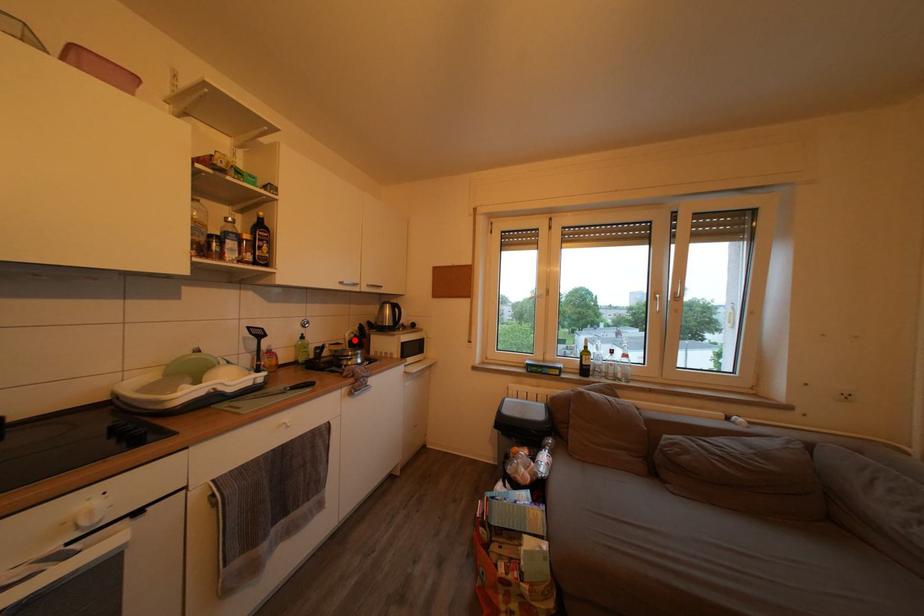
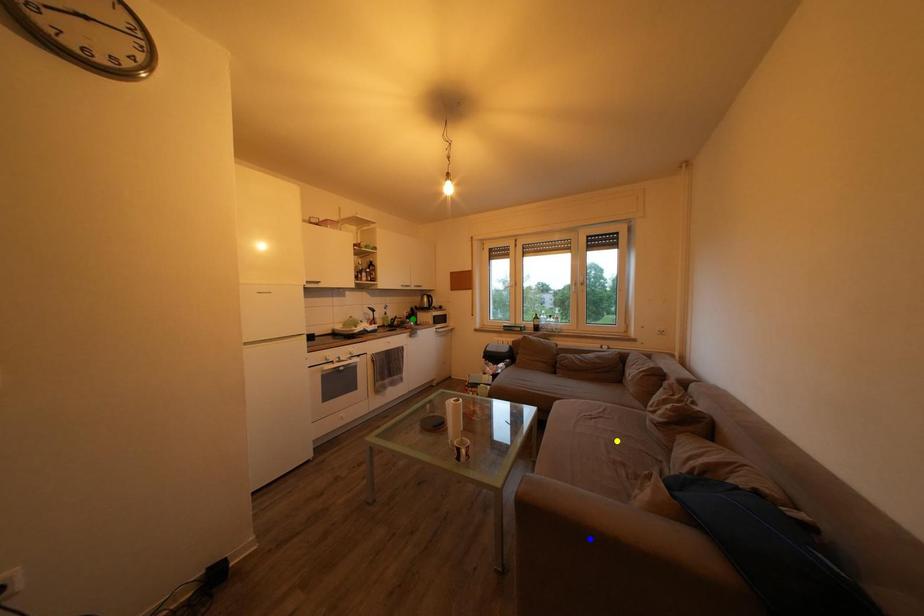
Question: I am providing you with two images of the same scene from different viewpoints. A red point is marked on the first image. You are given multiple points on the second image. Which point in image 2 is actually the same real-world point as the red point in image 1?

Choices:
 (A) green point
 (B) blue point
 (C) yellow point

Answer: (A)